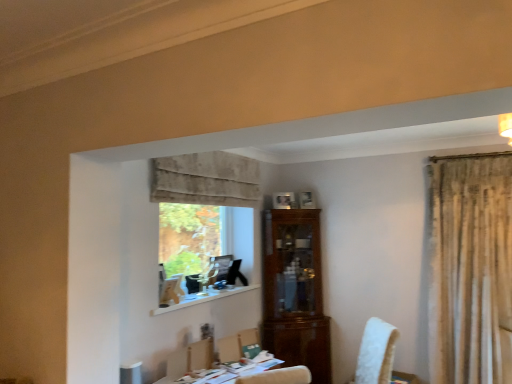
Question: From the image's perspective, is light brown wooden armchair at lower center under green fabric chair at center?

Choices:
 (A) no
 (B) yes

Answer: (A)

Question: Considering the relative sizes of light brown wooden armchair at lower center and green fabric chair at center in the image provided, is light brown wooden armchair at lower center taller than green fabric chair at center?

Choices:
 (A) no
 (B) yes

Answer: (A)

Question: From the image's perspective, is light brown wooden armchair at lower center on green fabric chair at center?

Choices:
 (A) yes
 (B) no

Answer: (A)

Question: Is light brown wooden armchair at lower center at the right side of green fabric chair at center?

Choices:
 (A) yes
 (B) no

Answer: (B)

Question: Is light brown wooden armchair at lower center oriented away from green fabric chair at center?

Choices:
 (A) yes
 (B) no

Answer: (B)

Question: Is point (242, 332) positioned closer to the camera than point (244, 288)?

Choices:
 (A) farther
 (B) closer

Answer: (B)

Question: Is green fabric chair at center in front of or behind white wood at lower center in the image?

Choices:
 (A) behind
 (B) front

Answer: (A)

Question: Is green fabric chair at center wider or thinner than white wood at lower center?

Choices:
 (A) thin
 (B) wide

Answer: (A)

Question: Is green fabric chair at center bigger or smaller than white wood at lower center?

Choices:
 (A) small
 (B) big

Answer: (A)

Question: From the image's perspective, is clear glass window at center above or below white wood at lower center?

Choices:
 (A) above
 (B) below

Answer: (A)

Question: Considering the positions of clear glass window at center and white wood at lower center in the image, is clear glass window at center taller or shorter than white wood at lower center?

Choices:
 (A) tall
 (B) short

Answer: (A)

Question: Is point (199, 228) positioned closer to the camera than point (258, 284)?

Choices:
 (A) closer
 (B) farther

Answer: (A)

Question: From a real-world perspective, is clear glass window at center above or below white wood at lower center?

Choices:
 (A) above
 (B) below

Answer: (A)

Question: In terms of height, does white wood at lower center look taller or shorter compared to clear glass window at center?

Choices:
 (A) short
 (B) tall

Answer: (A)

Question: Is point (209, 296) closer or farther from the camera than point (177, 264)?

Choices:
 (A) closer
 (B) farther

Answer: (A)